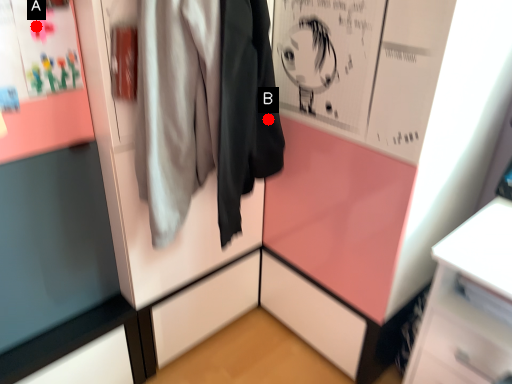
Question: Two points are circled on the image, labeled by A and B beside each circle. Which point is farther to the camera?

Choices:
 (A) A is further
 (B) B is further

Answer: (B)